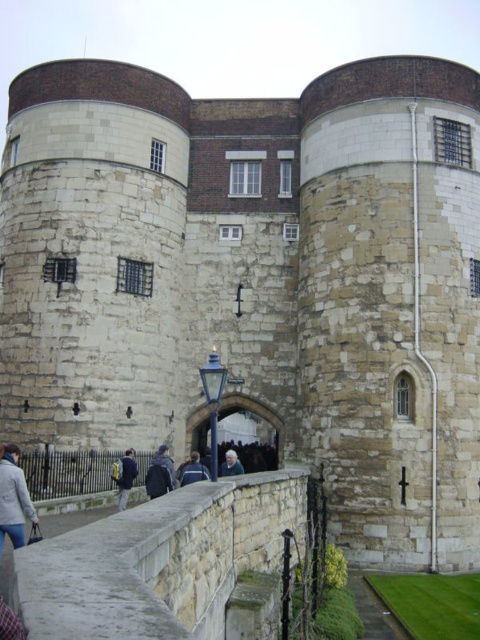
Question: Which point is closer to the camera?

Choices:
 (A) pos(120,472)
 (B) pos(232,456)
 (C) pos(165,476)
 (D) pos(203,476)

Answer: (C)

Question: Which point is farther to the camera?

Choices:
 (A) light gray fabric jacket at lower left
 (B) blue fabric jacket at center
 (C) dark blue jacket at center

Answer: (B)

Question: In this image, where is dark blue jacket at center located relative to blue fabric jacket at center?

Choices:
 (A) left
 (B) right

Answer: (A)

Question: Is blue denim jacket at lower center positioned in front of blue fabric jacket at center?

Choices:
 (A) no
 (B) yes

Answer: (A)

Question: Does dark blue jacket at center appear under gray hair at center?

Choices:
 (A) yes
 (B) no

Answer: (B)

Question: Which point is farther to the camera?

Choices:
 (A) blue fabric jacket at center
 (B) light gray fabric jacket at lower left
 (C) gray hair at center
 (D) blue denim jacket at lower center

Answer: (C)